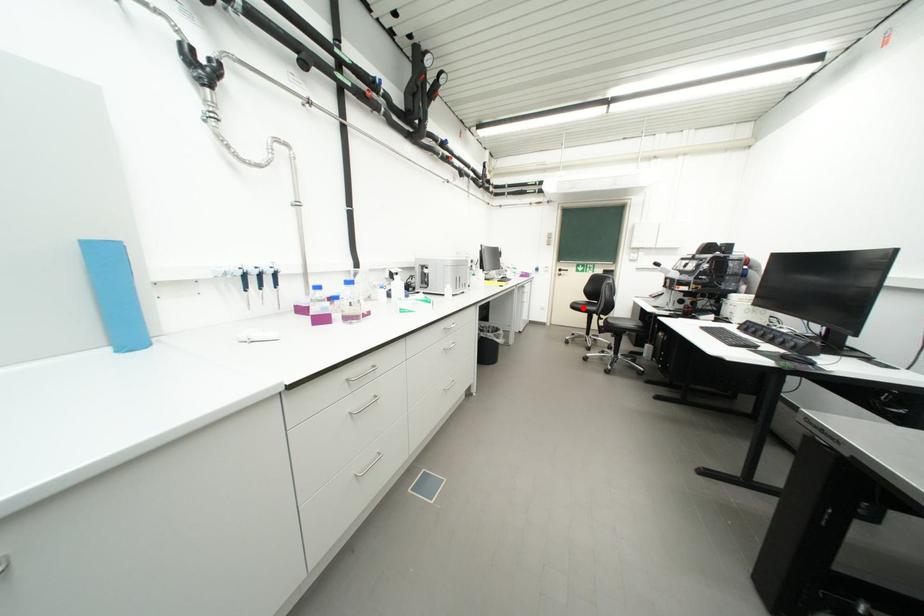
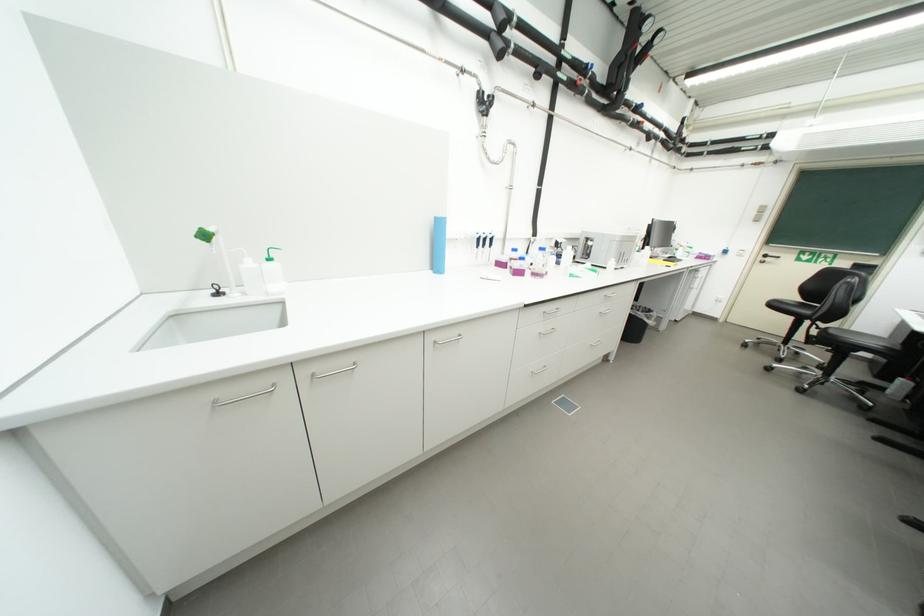
Where in the second image is the point corresponding to the highlighted location from the first image?

(783, 307)